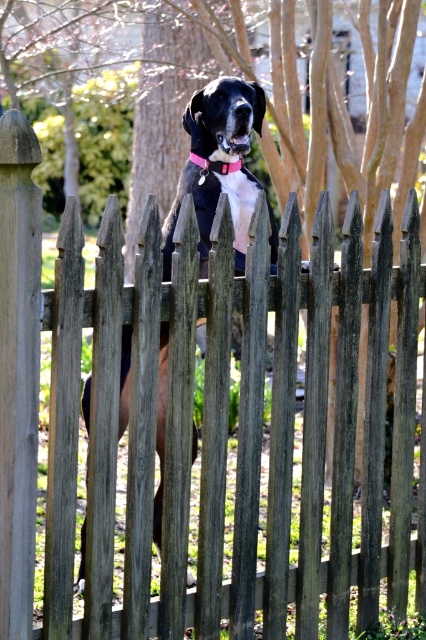
You are a photographer trying to capture the black matte dog at center and the pink fabric neckband at center in a single frame. Based on their heights, which one will appear larger in the photo?

The black matte dog at center is taller than the pink fabric neckband at center, so it will appear larger in the photo.

You are standing in front of the fence and want to know which of the two points, point (164, 243) or point (187, 157), is closer to you. Which one is it?

Point (164, 243) is closer to the camera than point (187, 157), so it is closer to you.

Consider the image. A child wants to throw a ball from the point at coordinates point [226,177] to the Great Dane dog behind the fence. The distance between them is 21.08 feet. If the child can throw the ball 20 feet, will the ball reach the dog?

The distance between the point at coordinates point [226,177] and the Great Dane dog behind the fence is 21.08 feet. Since the child can only throw the ball 20 feet, the ball will not reach the dog.